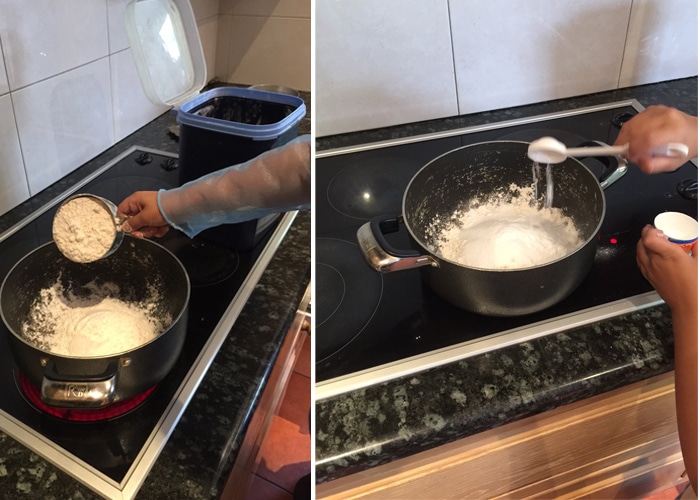
Where is `white tile`? Image resolution: width=700 pixels, height=500 pixels. white tile is located at coordinates (561, 48).